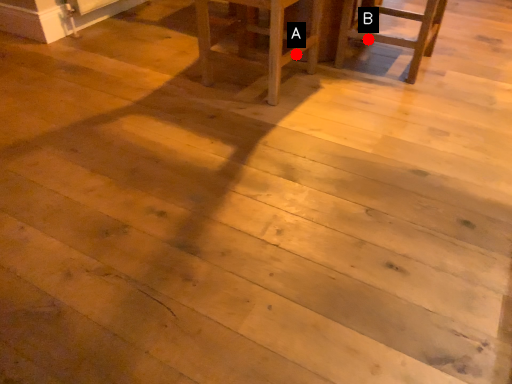
Question: Two points are circled on the image, labeled by A and B beside each circle. Which point is closer to the camera?

Choices:
 (A) A is closer
 (B) B is closer

Answer: (B)